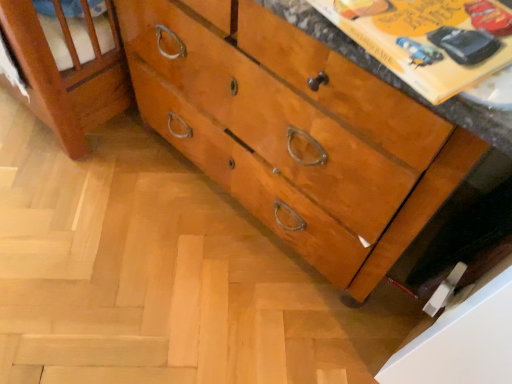
Question: Is yellow paper at upper right looking in the opposite direction of shiny wood chest of drawers at center?

Choices:
 (A) no
 (B) yes

Answer: (A)

Question: From the image's perspective, is yellow paper at upper right under shiny wood chest of drawers at center?

Choices:
 (A) no
 (B) yes

Answer: (B)

Question: Considering the relative positions of yellow paper at upper right and shiny wood chest of drawers at center in the image provided, is yellow paper at upper right to the left of shiny wood chest of drawers at center from the viewer's perspective?

Choices:
 (A) no
 (B) yes

Answer: (A)

Question: Is the position of yellow paper at upper right more distant than that of shiny wood chest of drawers at center?

Choices:
 (A) yes
 (B) no

Answer: (B)

Question: Can you confirm if yellow paper at upper right is wider than shiny wood chest of drawers at center?

Choices:
 (A) yes
 (B) no

Answer: (B)

Question: From a real-world perspective, is yellow paper at upper right beneath shiny wood chest of drawers at center?

Choices:
 (A) no
 (B) yes

Answer: (A)

Question: Does shiny wood chest of drawers at center have a greater height compared to yellow paper at upper right?

Choices:
 (A) no
 (B) yes

Answer: (B)

Question: From a real-world perspective, is shiny wood chest of drawers at center physically above yellow paper at upper right?

Choices:
 (A) no
 (B) yes

Answer: (A)

Question: Can we say shiny wood chest of drawers at center lies outside yellow paper at upper right?

Choices:
 (A) no
 (B) yes

Answer: (B)

Question: Can you confirm if shiny wood chest of drawers at center is bigger than yellow paper at upper right?

Choices:
 (A) yes
 (B) no

Answer: (A)

Question: Is the surface of shiny wood chest of drawers at center in direct contact with yellow paper at upper right?

Choices:
 (A) yes
 (B) no

Answer: (B)

Question: From the image's perspective, is shiny wood chest of drawers at center located above yellow paper at upper right?

Choices:
 (A) yes
 (B) no

Answer: (A)

Question: From the image's perspective, relative to shiny wood chest of drawers at center, is yellow paper at upper right above or below?

Choices:
 (A) below
 (B) above

Answer: (A)